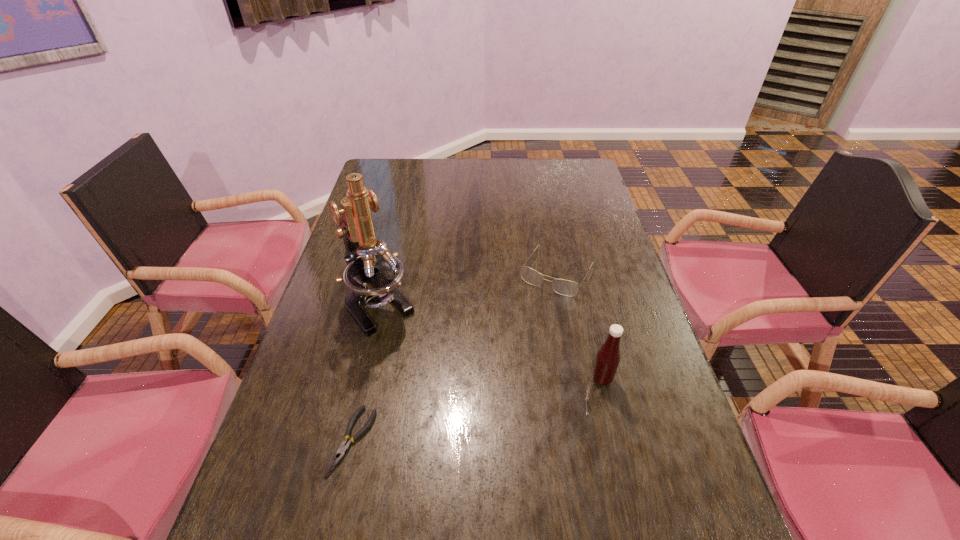
The height and width of the screenshot is (540, 960). I want to click on vacant region located 0.270m on the front-facing side of the second shortest object, so click(504, 363).

This screenshot has width=960, height=540. I want to click on free region located at the eyepiece of the tallest object, so click(x=408, y=344).

The height and width of the screenshot is (540, 960). I want to click on vacant space located at the eyepiece of the tallest object, so click(x=452, y=398).

In order to click on free location located at the eyepiece of the tallest object in this screenshot , I will do `click(476, 427)`.

Find the location of a particular element. Image resolution: width=960 pixels, height=540 pixels. object situated at the near edge is located at coordinates (345, 445).

Find the location of a particular element. This screenshot has height=540, width=960. pliers present at the left edge is located at coordinates (345, 445).

The height and width of the screenshot is (540, 960). I want to click on microscope located in the left edge section of the desktop, so click(373, 275).

Locate an element on the screen. The image size is (960, 540). Tabasco sauce present at the right edge is located at coordinates (607, 360).

I want to click on spectacles at the right edge, so [x=569, y=288].

I want to click on object positioned at the near left corner, so click(x=345, y=445).